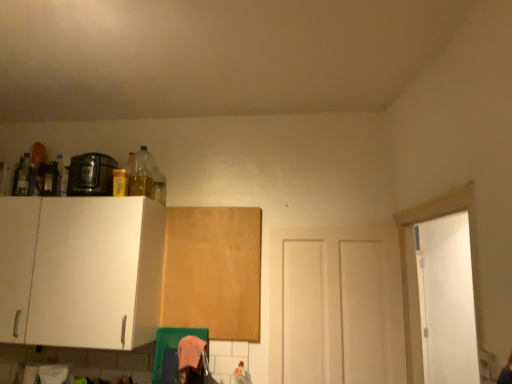
Question: Is wooden board at center, positioned as the 1th cabinetry in right-to-left order, positioned far away from white matte door at center?

Choices:
 (A) yes
 (B) no

Answer: (B)

Question: Does wooden board at center, positioned as the 1th cabinetry in right-to-left order, come behind white matte door at center?

Choices:
 (A) no
 (B) yes

Answer: (B)

Question: Is wooden board at center, which ranks as the 2th cabinetry in left-to-right order, bigger than white matte door at center?

Choices:
 (A) yes
 (B) no

Answer: (B)

Question: From a real-world perspective, is wooden board at center, which ranks as the 2th cabinetry in left-to-right order, physically below white matte door at center?

Choices:
 (A) no
 (B) yes

Answer: (A)

Question: Can you confirm if wooden board at center, which ranks as the 2th cabinetry in left-to-right order, is wider than white matte door at center?

Choices:
 (A) no
 (B) yes

Answer: (A)

Question: Can you confirm if wooden board at center, which ranks as the 2th cabinetry in left-to-right order, is taller than white matte door at center?

Choices:
 (A) no
 (B) yes

Answer: (A)

Question: Is wooden board at center, which ranks as the 2th cabinetry in left-to-right order, outside white matte cabinet at left, the first cabinetry positioned from the left?

Choices:
 (A) yes
 (B) no

Answer: (A)

Question: Is wooden board at center, positioned as the 1th cabinetry in right-to-left order, in front of white matte cabinet at left, the second cabinetry in the right-to-left sequence?

Choices:
 (A) no
 (B) yes

Answer: (A)

Question: Could white matte cabinet at left, the first cabinetry positioned from the left, be considered to be inside wooden board at center, which ranks as the 2th cabinetry in left-to-right order?

Choices:
 (A) no
 (B) yes

Answer: (A)

Question: Does wooden board at center, positioned as the 1th cabinetry in right-to-left order, have a greater height compared to white matte cabinet at left, the second cabinetry in the right-to-left sequence?

Choices:
 (A) yes
 (B) no

Answer: (A)

Question: Is wooden board at center, positioned as the 1th cabinetry in right-to-left order, oriented towards white matte cabinet at left, the second cabinetry in the right-to-left sequence?

Choices:
 (A) yes
 (B) no

Answer: (B)

Question: From the image's perspective, does wooden board at center, positioned as the 1th cabinetry in right-to-left order, appear higher than white matte cabinet at left, the second cabinetry in the right-to-left sequence?

Choices:
 (A) yes
 (B) no

Answer: (B)

Question: Is shiny black toaster at upper left closer to the viewer compared to wooden board at center, which ranks as the 2th cabinetry in left-to-right order?

Choices:
 (A) yes
 (B) no

Answer: (A)